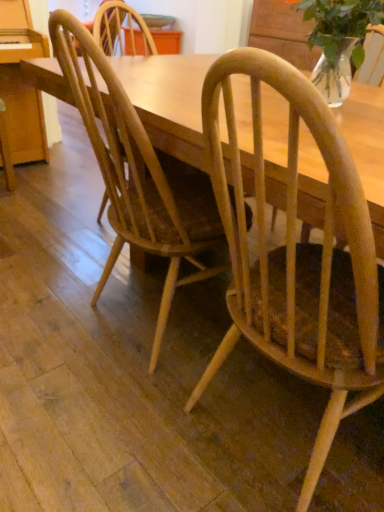
Question: From the image's perspective, is light brown wood chair at center, which is counted as the first chair, starting from the right, above or below natural wood chair at center, which is the 1th chair in left-to-right order?

Choices:
 (A) above
 (B) below

Answer: (B)

Question: Is light brown wood chair at center, which appears as the 2th chair when viewed from the left, spatially inside natural wood chair at center, marked as the 2th chair in a right-to-left arrangement, or outside of it?

Choices:
 (A) inside
 (B) outside

Answer: (B)

Question: Estimate the real-world distances between objects in this image. Which object is closer to the clear glass vase at upper right?

Choices:
 (A) natural wood chair at center, which is the 1th chair in left-to-right order
 (B) light brown wood chair at center, which is counted as the first chair, starting from the right

Answer: (B)

Question: Which is farther from the light brown wood chair at center, which appears as the 2th chair when viewed from the left?

Choices:
 (A) natural wood chair at center, which is the 1th chair in left-to-right order
 (B) clear glass vase at upper right

Answer: (B)